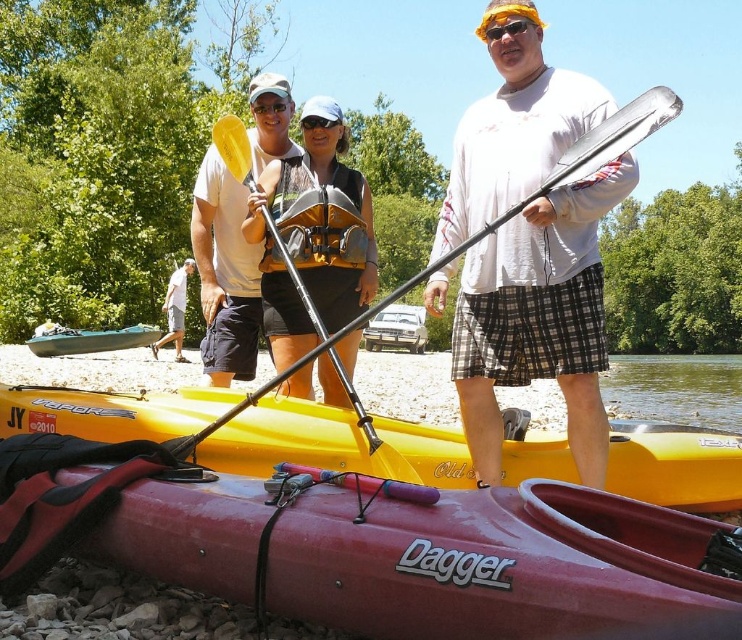
Between teal plastic kayak at lower left and matte yellow sunglasses at center, which one is positioned higher?

matte yellow sunglasses at center is higher up.

Is teal plastic kayak at lower left bigger than matte yellow sunglasses at center?

Correct, teal plastic kayak at lower left is larger in size than matte yellow sunglasses at center.

Is point (131, 339) in front of point (487, 29)?

No, it is behind (487, 29).

What are the coordinates of `teal plastic kayak at lower left` in the screenshot? It's located at (91, 340).

Is point (522, 138) closer to camera compared to point (174, 317)?

Yes, it is in front of point (174, 317).

Is white matte shirt at upper center to the left of white cotton shirt at lower left from the viewer's perspective?

In fact, white matte shirt at upper center is to the right of white cotton shirt at lower left.

What do you see at coordinates (538, 320) in the screenshot?
I see `white matte shirt at upper center` at bounding box center [538, 320].

Locate an element on the screen. The width and height of the screenshot is (742, 640). white matte shirt at upper center is located at coordinates (538, 320).

Which is behind, point (325, 531) or point (289, 276)?

The point (289, 276) is behind.

Can you confirm if maroon plastic kayak at lower center is bigger than yellow plastic paddle at center?

Yes.

Is point (36, 500) closer to camera compared to point (390, 458)?

Yes, it is in front of point (390, 458).

Identify the location of maroon plastic kayak at lower center. (364, 544).